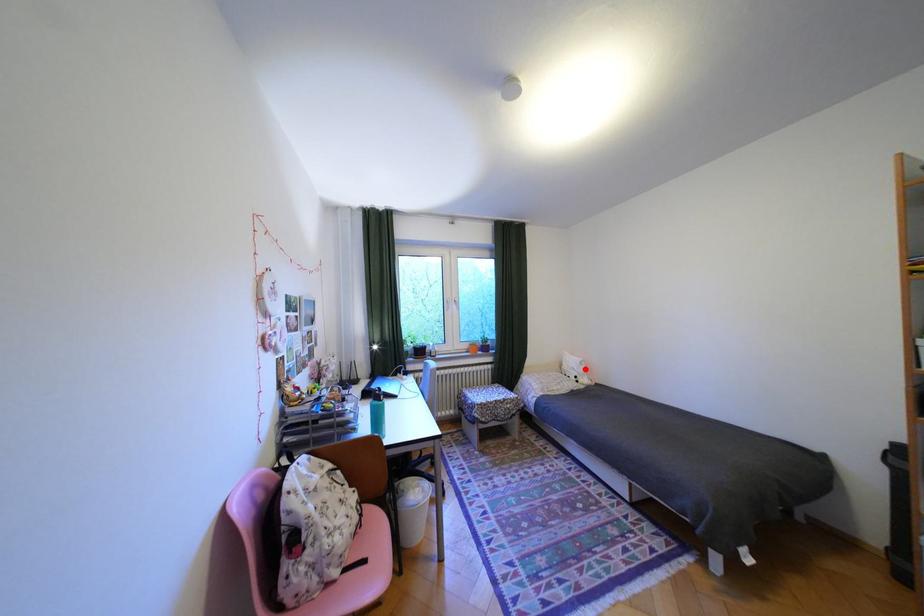
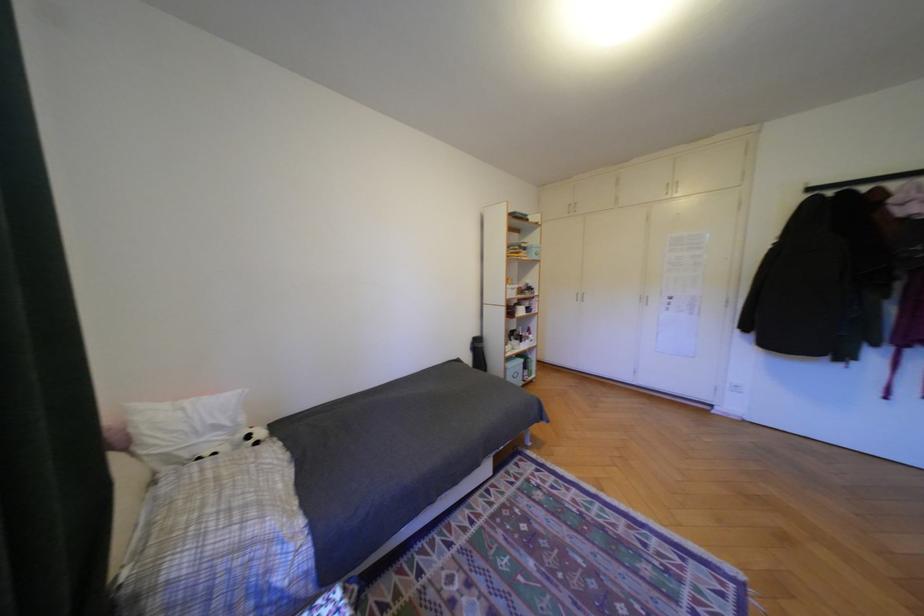
Locate, in the second image, the point that corresponds to the highlighted location in the first image.

(228, 427)